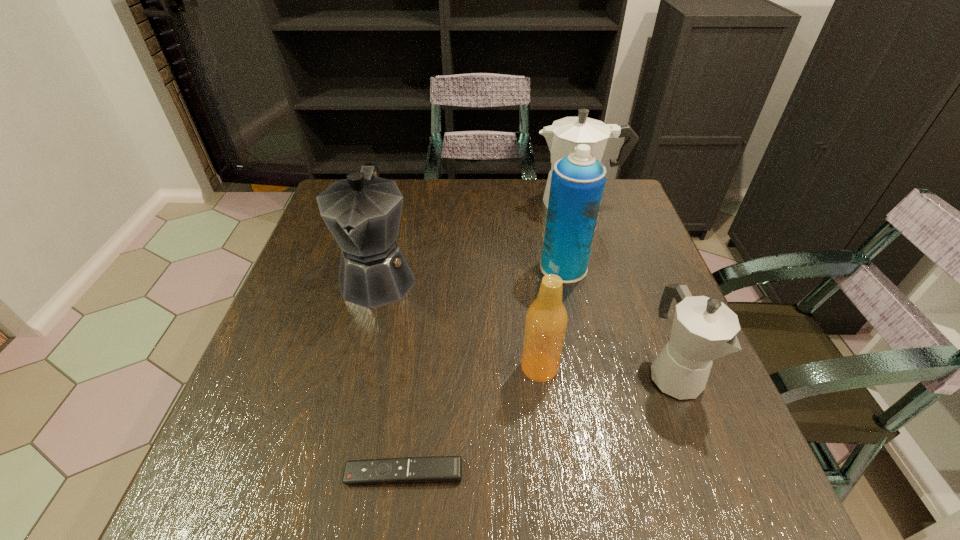
You are a GUI agent. You are given a task and a screenshot of the screen. Output one action in this format:
    pyautogui.click(x=<x>, y=<y>)
    Task: Click on the vacant space that is in between the aerosol can and the nearest coffeepot
    The height and width of the screenshot is (540, 960).
    Given the screenshot: What is the action you would take?
    pyautogui.click(x=619, y=321)

You are a GUI agent. You are given a task and a screenshot of the screen. Output one action in this format:
    pyautogui.click(x=<x>, y=<y>)
    Task: Click on the unoccupied area between the nearest object and the farthest coffeepot
    The height and width of the screenshot is (540, 960).
    Given the screenshot: What is the action you would take?
    pyautogui.click(x=491, y=338)

The height and width of the screenshot is (540, 960). Identify the location of object that stands as the closest to the nearest coffeepot. (546, 321).

Identify the location of object that stands as the third closest to the farthest coffeepot. (704, 329).

You are a GUI agent. You are given a task and a screenshot of the screen. Output one action in this format:
    pyautogui.click(x=<x>, y=<y>)
    Task: Click on the coffeepot that is the closest to the leftmost coffeepot
    
    Given the screenshot: What is the action you would take?
    pyautogui.click(x=562, y=137)

Locate which coffeepot ranks second in proximity to the leftmost coffeepot. Please provide its 2D coordinates. Your answer should be formatted as a tuple, i.e. [(x, y)], where the tuple contains the x and y coordinates of a point satisfying the conditions above.

[(704, 329)]

Where is `vacant space that satisfies the following two spatial constraints: 1. at the spout of the farthest object; 2. on the back side of the nearest coffeepot`? vacant space that satisfies the following two spatial constraints: 1. at the spout of the farthest object; 2. on the back side of the nearest coffeepot is located at coordinates (627, 375).

Where is `vacant point that satisfies the following two spatial constraints: 1. at the spout of the beer bottle; 2. on the left side of the leftmost coffeepot`? Image resolution: width=960 pixels, height=540 pixels. vacant point that satisfies the following two spatial constraints: 1. at the spout of the beer bottle; 2. on the left side of the leftmost coffeepot is located at coordinates (356, 367).

Image resolution: width=960 pixels, height=540 pixels. Find the location of `free space that satisfies the following two spatial constraints: 1. at the spout of the second nearest coffeepot; 2. on the left side of the beer bottle`. free space that satisfies the following two spatial constraints: 1. at the spout of the second nearest coffeepot; 2. on the left side of the beer bottle is located at coordinates (356, 367).

The height and width of the screenshot is (540, 960). I want to click on free space that satisfies the following two spatial constraints: 1. at the spout of the beer bottle; 2. on the left side of the leftmost coffeepot, so click(356, 367).